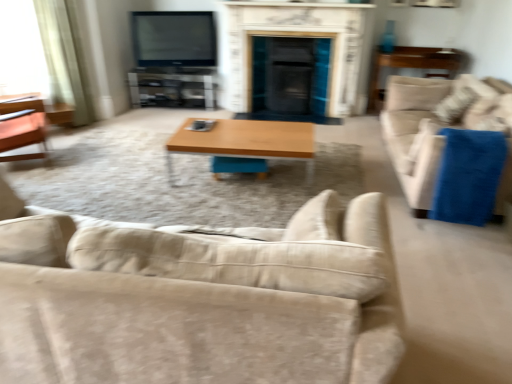
Question: From their relative heights in the image, would you say beige fabric couch at lower center, the second studio couch in the right-to-left sequence, is taller or shorter than white marble fireplace at center?

Choices:
 (A) short
 (B) tall

Answer: (A)

Question: Is point (182, 350) positioned closer to the camera than point (325, 36)?

Choices:
 (A) farther
 (B) closer

Answer: (B)

Question: Which of these objects is positioned closest to the wooden side table at right?

Choices:
 (A) light beige fabric curtain at left
 (B) beige fabric couch at lower center, which is counted as the second studio couch, starting from the back
 (C) white marble fireplace at center
 (D) clear glass entertainment center at center
 (E) wooden/matte coffee table at center

Answer: (C)

Question: Considering the real-world distances, which object is closest to the beige fabric couch at right, which is the 2th studio couch in left-to-right order?

Choices:
 (A) white marble fireplace at center
 (B) clear glass entertainment center at center
 (C) matte black tv at upper center
 (D) wooden/matte coffee table at center
 (E) wooden side table at right

Answer: (D)